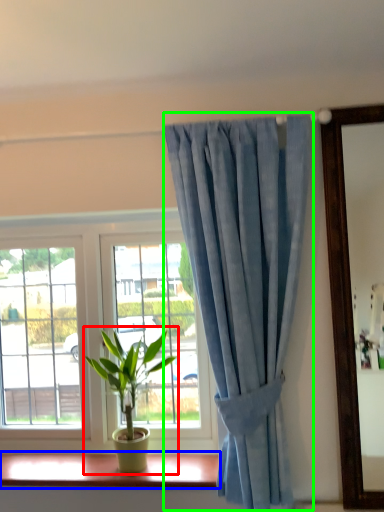
Question: Considering the real-world distances, which object is farthest from houseplant (highlighted by a red box)? window sill (highlighted by a blue box) or curtain (highlighted by a green box)?

Choices:
 (A) window sill
 (B) curtain

Answer: (B)